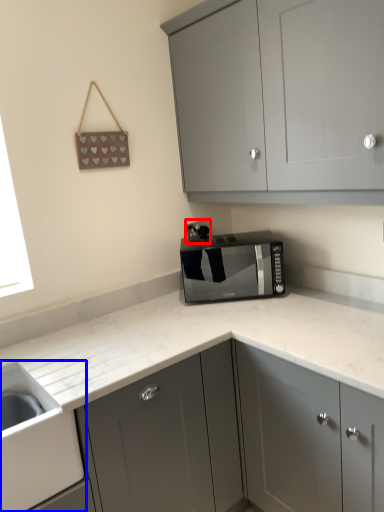
Question: Among these objects, which one is nearest to the camera, electric outlet (highlighted by a red box) or sink (highlighted by a blue box)?

Choices:
 (A) electric outlet
 (B) sink

Answer: (B)